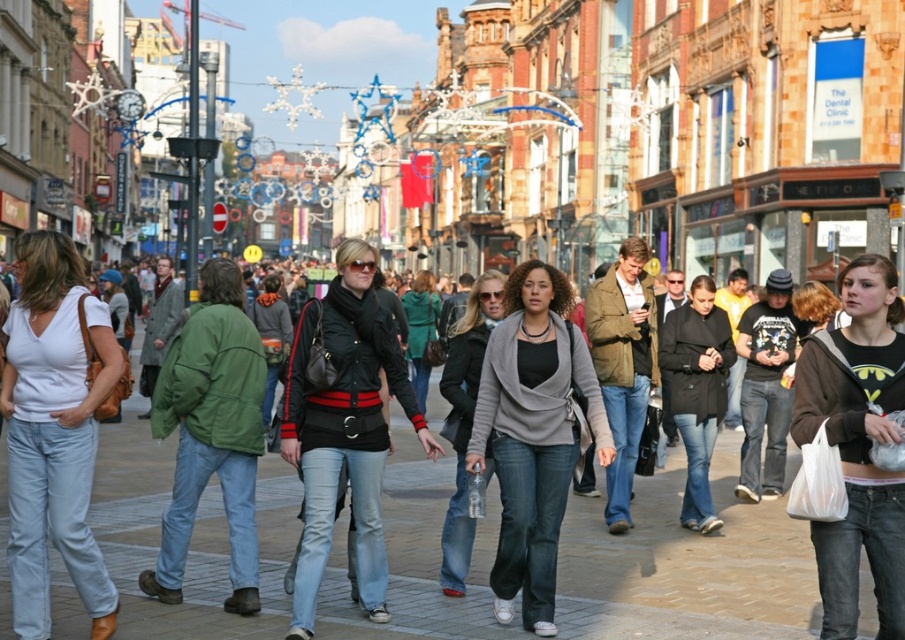
Question: Which point appears farthest from the camera in this image?

Choices:
 (A) (472, 412)
 (B) (561, 323)
 (C) (125, 474)
 (D) (854, 628)

Answer: (C)

Question: Is gray knit sweater at center closer to the viewer compared to black leather jacket at center?

Choices:
 (A) yes
 (B) no

Answer: (B)

Question: Is white matte shirt at center positioned in front of matte black jacket at center?

Choices:
 (A) no
 (B) yes

Answer: (B)

Question: Which object is the closest to the gray knit sweater at center?

Choices:
 (A) black leather jacket at center
 (B) white matte shirt at center

Answer: (A)

Question: Which point is closer to the camera?

Choices:
 (A) gray knit sweater at center
 (B) green leather jacket at center
 (C) matte brown hoodie at center
 (D) black leather jacket at center

Answer: (C)

Question: From the image, what is the correct spatial relationship of denim jeans at center in relation to gray knit sweater at center?

Choices:
 (A) right
 (B) left

Answer: (B)